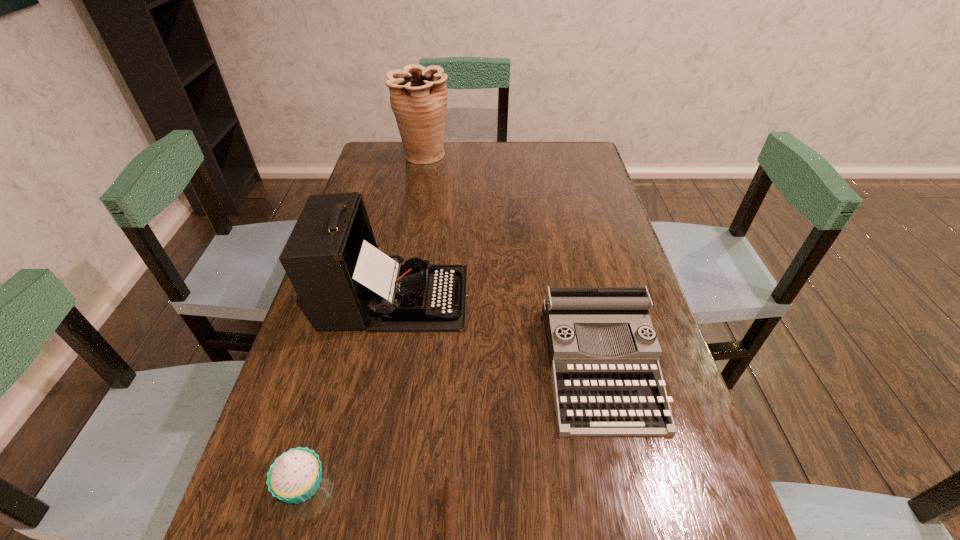
Identify the location of urn that is at the left edge. (418, 96).

Where is `typewriter that is at the left edge`? typewriter that is at the left edge is located at coordinates (331, 257).

Find the location of `cupcake that is at the left edge`. cupcake that is at the left edge is located at coordinates (295, 476).

The height and width of the screenshot is (540, 960). I want to click on object that is at the right edge, so click(x=603, y=351).

The image size is (960, 540). Identify the location of object at the far left corner. (418, 96).

In the image, there is a desktop. At what (x,y) coordinates should I click in order to perform the action: click on free space at the far edge. Please return your answer as a coordinate pair (x, y). The height and width of the screenshot is (540, 960). Looking at the image, I should click on (492, 156).

Where is `vacant region at the left edge of the desktop`? vacant region at the left edge of the desktop is located at coordinates (298, 522).

This screenshot has width=960, height=540. In order to click on free region at the right edge of the desktop in this screenshot , I will do `click(581, 187)`.

At what (x,y) coordinates should I click in order to perform the action: click on free space between the left typewriter and the urn. Please return your answer as a coordinate pair (x, y). The image size is (960, 540). Looking at the image, I should click on (409, 226).

At what (x,y) coordinates should I click in order to perform the action: click on free space between the cupcake and the rightmost object. Please return your answer as a coordinate pair (x, y). This screenshot has height=540, width=960. Looking at the image, I should click on (451, 424).